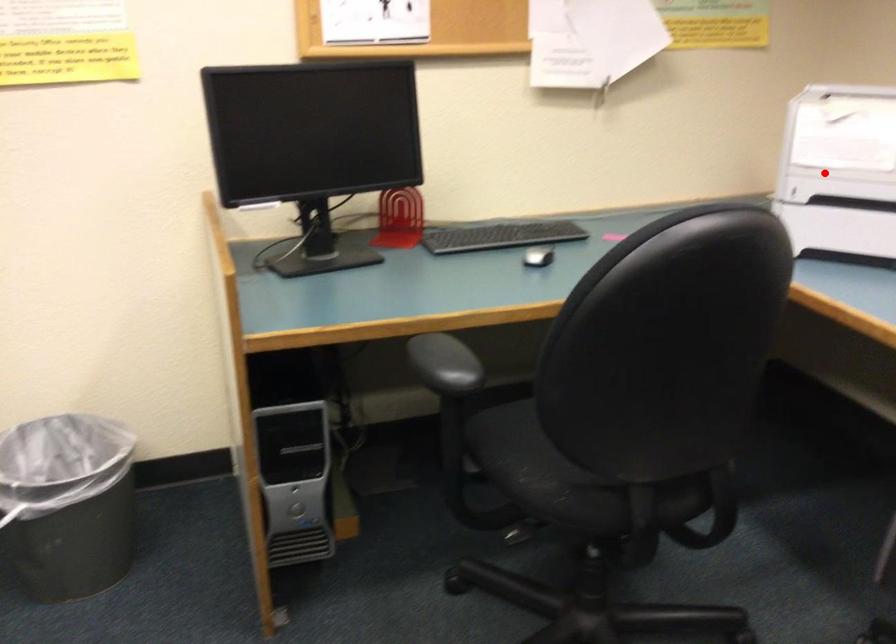
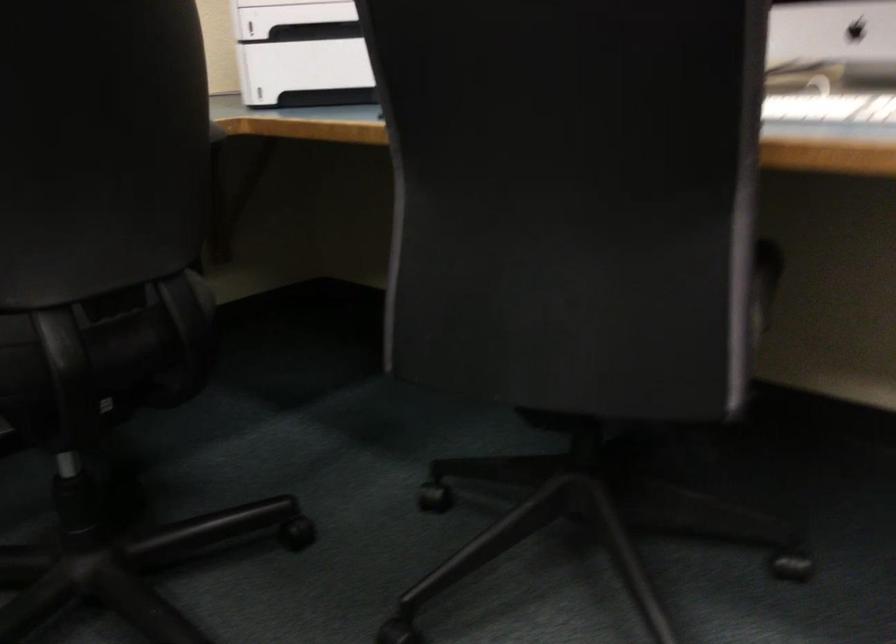
Find the pixel in the second image that matches the highlighted location in the first image.

(291, 17)